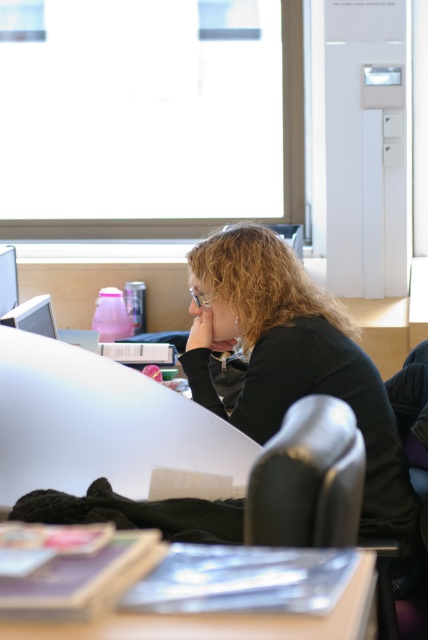
You are standing in front of the desk in the image and want to reach both the point at coordinate (x=332, y=376) and the point at coordinate (x=259, y=449). Which point will you reach first?

The point at coordinate (x=332, y=376) is closer to you than the point at coordinate (x=259, y=449), so you will reach the point at coordinate (x=332, y=376) first.

You are trying to locate the black matte jacket at center in a photo of a study area. If the photo is divided into a grid with coordinates from 0 to 1 on both axes, where would you look first?

The black matte jacket at center is located at the 2D coordinates point [291,360], so you should look near that position first.

You are a student who needs to place a tall textbook on the desk. Which desk, the white glossy desk at center or the matte plastic table at lower center, can accommodate the textbook without it hanging off the edge?

The white glossy desk at center is taller than the matte plastic table at lower center, so the textbook can be placed on the white glossy desk at center as it has sufficient height to accommodate the textbook without it hanging off the edge.